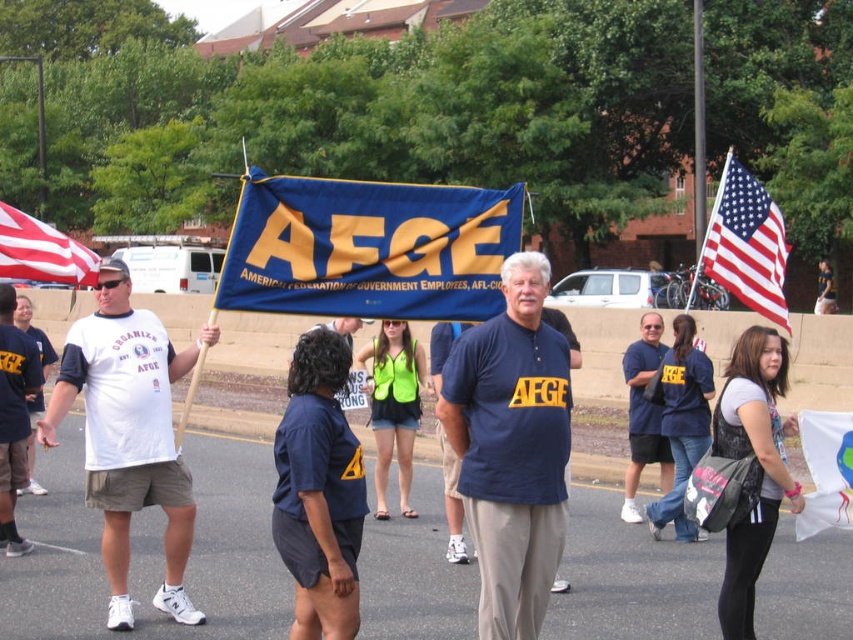
Question: Can you confirm if bluematerial/textureflag at center is wider than white t-shirt at left?

Choices:
 (A) no
 (B) yes

Answer: (A)

Question: Can you confirm if red-white-blue fabric flag at upper right is positioned below neon green mesh vest at center?

Choices:
 (A) no
 (B) yes

Answer: (A)

Question: Which is farther from the neon green mesh vest at center?

Choices:
 (A) red-white-blue fabric flag at upper right
 (B) blue cotton shirt at center
 (C) bluematerial/textureflag at center

Answer: (C)

Question: Does red-white-blue fabric flag at upper right appear on the right side of neon green mesh vest at center?

Choices:
 (A) yes
 (B) no

Answer: (A)

Question: Which point appears farthest from the camera in this image?

Choices:
 (A) (653, 436)
 (B) (311, 525)
 (C) (114, 432)

Answer: (A)

Question: Which point appears farthest from the camera in this image?

Choices:
 (A) (15, 236)
 (B) (734, 189)
 (C) (730, 637)

Answer: (B)